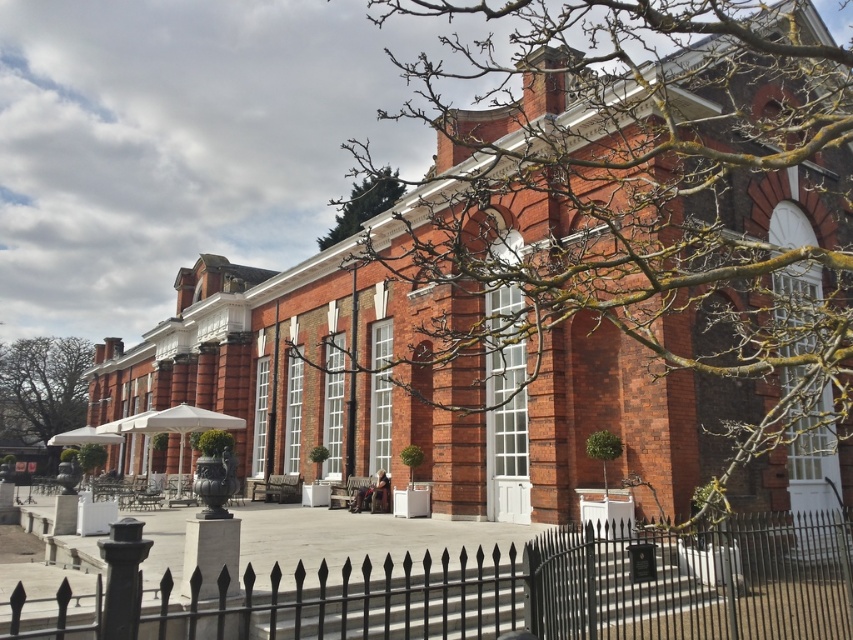
How much distance is there between bare branches at center and black wrought iron fence at lower center?

bare branches at center is 26.10 meters away from black wrought iron fence at lower center.

Can you confirm if bare branches at center is positioned to the left of black wrought iron fence at lower center?

In fact, bare branches at center is to the right of black wrought iron fence at lower center.

Is point (730, 51) more distant than point (114, 566)?

Yes, it is.

Locate an element on the screen. The image size is (853, 640). bare branches at center is located at coordinates (639, 212).

Between black wrought iron fence at lower center and green leafy tree at upper center, which one is positioned lower?

black wrought iron fence at lower center is below.

Does black wrought iron fence at lower center lie behind green leafy tree at upper center?

No, it is not.

The width and height of the screenshot is (853, 640). Find the location of `black wrought iron fence at lower center`. black wrought iron fence at lower center is located at coordinates (483, 588).

Image resolution: width=853 pixels, height=640 pixels. Find the location of `green leafy tree at lower left`. green leafy tree at lower left is located at coordinates (42, 388).

Does point (20, 344) lie behind point (370, 209)?

Yes.

This screenshot has width=853, height=640. Identify the location of green leafy tree at lower left. 42,388.